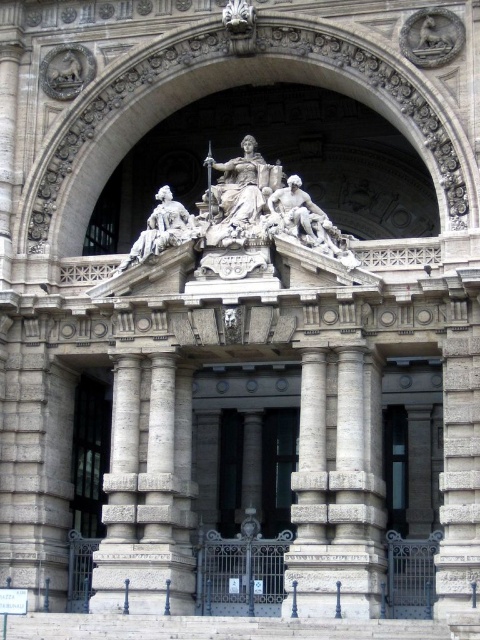
Who is positioned more to the left, stone archway at center or light gray stone column at center?

Positioned to the left is stone archway at center.

Which is more to the right, stone archway at center or light gray stone column at center?

Positioned to the right is light gray stone column at center.

This screenshot has height=640, width=480. I want to click on stone archway at center, so click(x=243, y=84).

Is light gray stone column at center closer to the viewer compared to gray stone column at center?

Yes, it is.

Which of these two, light gray stone column at center or gray stone column at center, stands taller?

gray stone column at center is taller.

Does point (298, 518) lie in front of point (158, 380)?

Yes, it is in front of point (158, 380).

Identify the location of light gray stone column at center. (337, 486).

Can you confirm if stone archway at center is thinner than glass paneled door at center?

No, stone archway at center is not thinner than glass paneled door at center.

How much distance is there between stone archway at center and glass paneled door at center?

15.64 meters

Which is behind, point (54, 170) or point (96, 493)?

The point (96, 493) is behind.

The image size is (480, 640). I want to click on stone archway at center, so click(x=243, y=84).